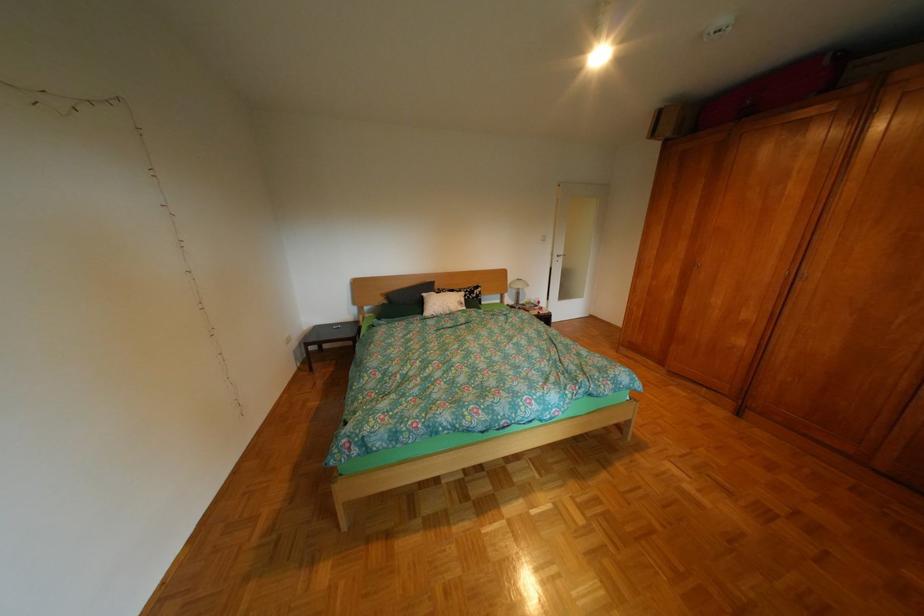
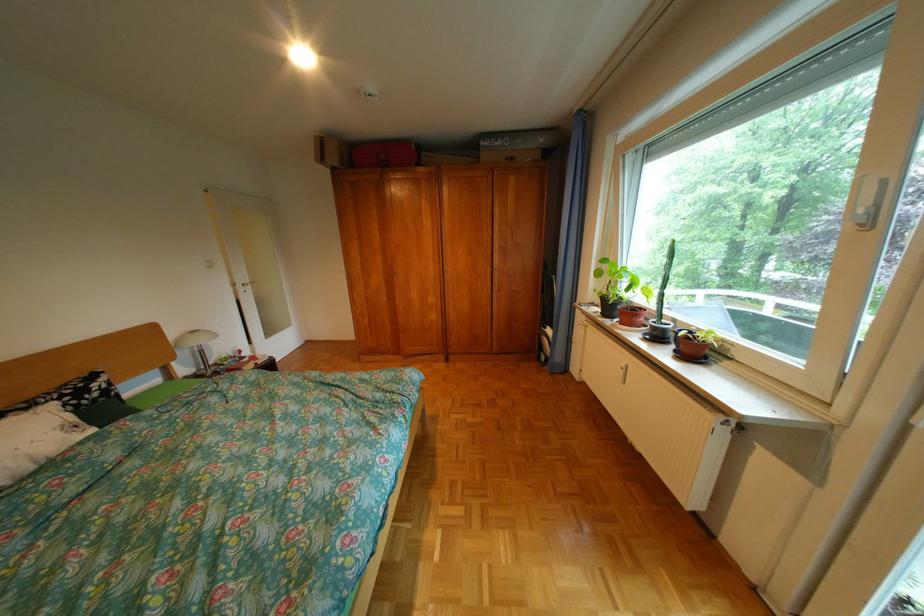
The point at [566,254] is marked in the first image. Where is the corresponding point in the second image?

(248, 285)